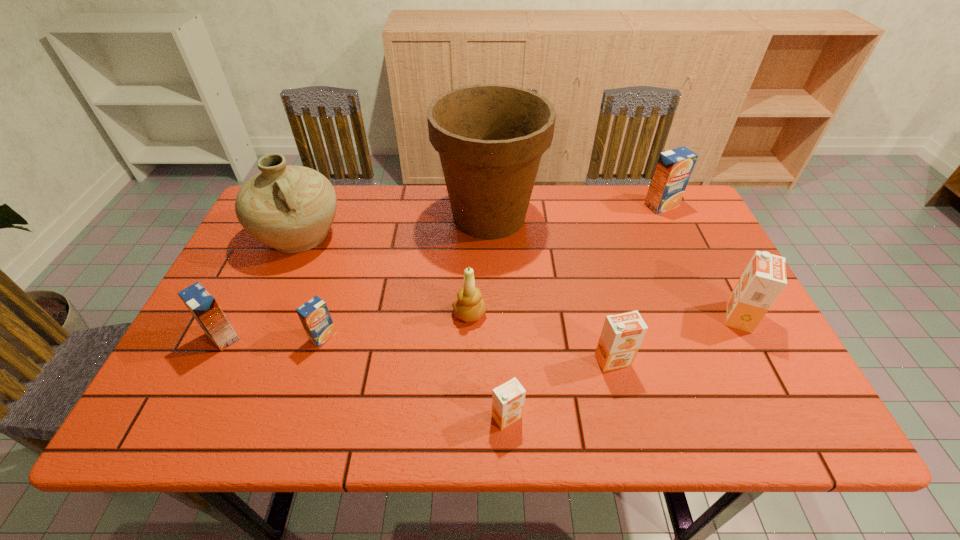
Find the location of a particular element. Image resolution: width=960 pixels, height=540 pixels. orange juice that is the sixth closest to the flowerpot is located at coordinates (202, 305).

Find the location of a particular element. The width and height of the screenshot is (960, 540). blue orange_juice that is the nearest to the nearest object is located at coordinates (314, 315).

You are a GUI agent. You are given a task and a screenshot of the screen. Output one action in this format:
    pyautogui.click(x=<x>, y=<y>)
    Task: Click on the closest blue orange_juice relative to the flowerpot
    
    Given the screenshot: What is the action you would take?
    pyautogui.click(x=674, y=167)

I want to click on orange orange juice that can be found as the second closest to the smallest orange orange juice, so click(764, 278).

The height and width of the screenshot is (540, 960). I want to click on orange orange juice identified as the closest to the farthest orange orange juice, so click(x=622, y=334).

The image size is (960, 540). In order to click on vacant area that satisfies the following two spatial constraints: 1. on the front side of the flowerpot; 2. on the right side of the second smallest orange orange juice in this screenshot , I will do `click(492, 360)`.

At what (x,y) coordinates should I click in order to perform the action: click on vacant space that satisfies the following two spatial constraints: 1. on the back side of the farthest orange juice; 2. on the left side of the leftmost blue orange_juice. Please return your answer as a coordinate pair (x, y). The height and width of the screenshot is (540, 960). Looking at the image, I should click on (288, 206).

I want to click on free location that satisfies the following two spatial constraints: 1. on the back side of the nearest orange orange juice; 2. on the right side of the biggest orange orange juice, so click(x=502, y=316).